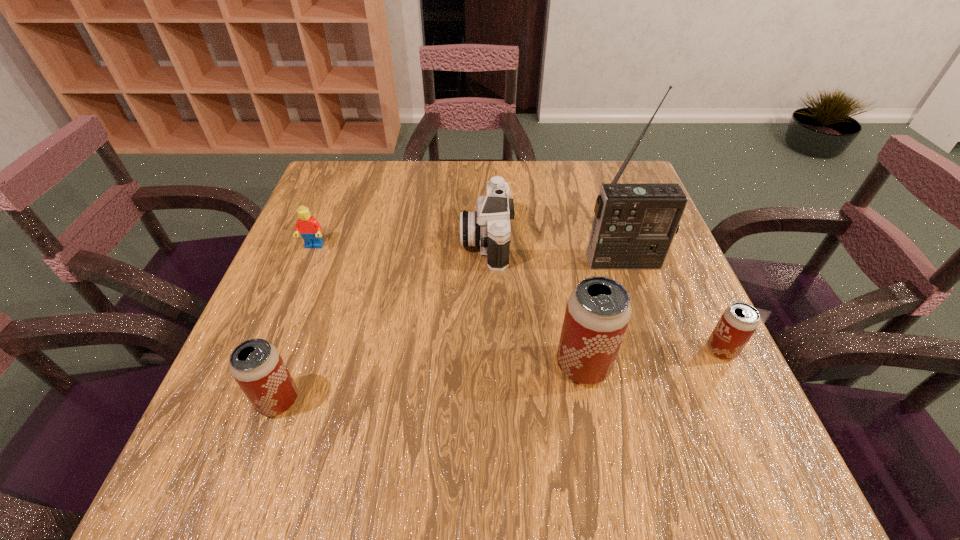
Where is `the leftmost beer can`? The width and height of the screenshot is (960, 540). the leftmost beer can is located at coordinates (256, 365).

Locate an element on the screen. the fifth shortest object is located at coordinates (598, 311).

Find the location of a particular element. This screenshot has height=540, width=960. the fourth object from left to right is located at coordinates (598, 311).

Locate an element on the screen. The width and height of the screenshot is (960, 540). the rightmost beer can is located at coordinates (739, 321).

Locate an element on the screen. the shortest beer can is located at coordinates (739, 321).

Locate an element on the screen. The height and width of the screenshot is (540, 960). Lego is located at coordinates (310, 229).

You are a GUI agent. You are given a task and a screenshot of the screen. Output one action in this format:
    pyautogui.click(x=<x>, y=<y>)
    Task: Click on the camera
    
    Given the screenshot: What is the action you would take?
    pyautogui.click(x=489, y=227)

This screenshot has height=540, width=960. I want to click on radio receiver, so click(634, 225).

Identify the location of the tallest object. (634, 225).

Locate an element on the screen. free space located 0.250m on the back of the leftmost beer can is located at coordinates (321, 283).